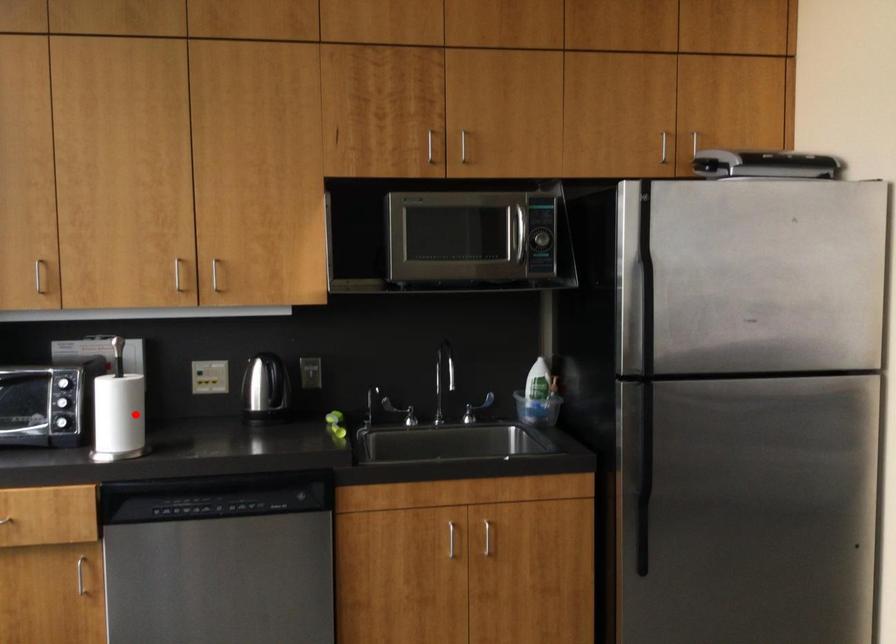
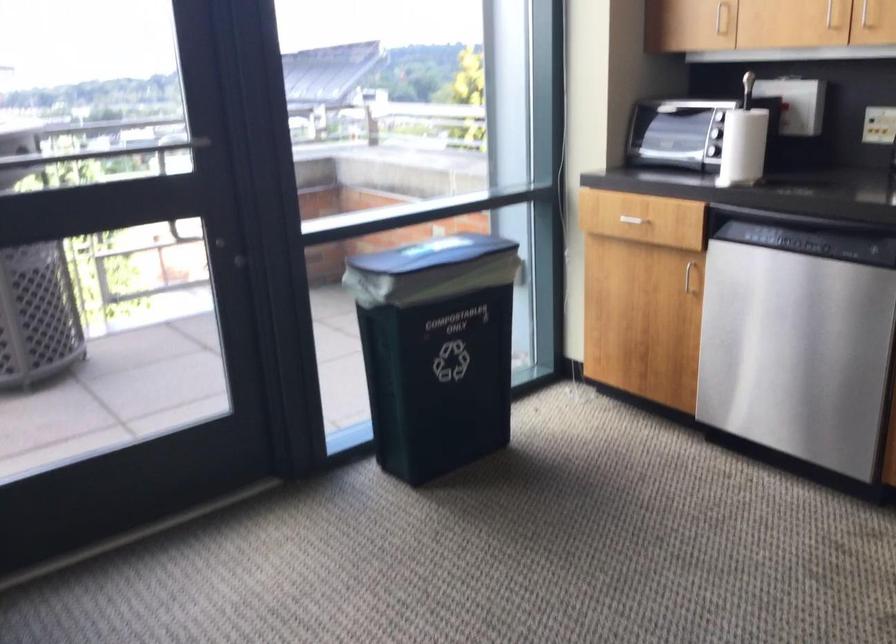
The point at the highlighted location is marked in the first image. Where is the corresponding point in the second image?

(743, 146)